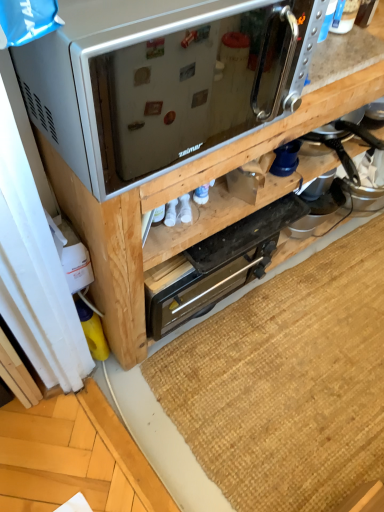
Question: Does brown woven mat at lower center contain black metallic toaster oven at center?

Choices:
 (A) yes
 (B) no

Answer: (B)

Question: Is brown woven mat at lower center positioned in front of black metallic toaster oven at center?

Choices:
 (A) yes
 (B) no

Answer: (B)

Question: Can you confirm if brown woven mat at lower center is shorter than black metallic toaster oven at center?

Choices:
 (A) yes
 (B) no

Answer: (A)

Question: From a real-world perspective, is brown woven mat at lower center over black metallic toaster oven at center?

Choices:
 (A) no
 (B) yes

Answer: (A)

Question: From the image's perspective, would you say brown woven mat at lower center is shown under black metallic toaster oven at center?

Choices:
 (A) yes
 (B) no

Answer: (A)

Question: Considering the relative positions of brown woven mat at lower center and black metallic toaster oven at center in the image provided, is brown woven mat at lower center to the left of black metallic toaster oven at center from the viewer's perspective?

Choices:
 (A) no
 (B) yes

Answer: (A)

Question: Is satin silver microwave at upper center shorter than brown woven mat at lower center?

Choices:
 (A) no
 (B) yes

Answer: (A)

Question: Is satin silver microwave at upper center next to brown woven mat at lower center and touching it?

Choices:
 (A) no
 (B) yes

Answer: (A)

Question: From the image's perspective, does satin silver microwave at upper center appear higher than brown woven mat at lower center?

Choices:
 (A) yes
 (B) no

Answer: (A)

Question: Would you say brown woven mat at lower center is part of satin silver microwave at upper center's contents?

Choices:
 (A) yes
 (B) no

Answer: (B)

Question: Does satin silver microwave at upper center have a lesser width compared to brown woven mat at lower center?

Choices:
 (A) no
 (B) yes

Answer: (B)

Question: Does satin silver microwave at upper center appear on the left side of brown woven mat at lower center?

Choices:
 (A) no
 (B) yes

Answer: (B)

Question: Is metallic silver toaster oven at upper center facing away from brown woven mat at lower center?

Choices:
 (A) no
 (B) yes

Answer: (A)